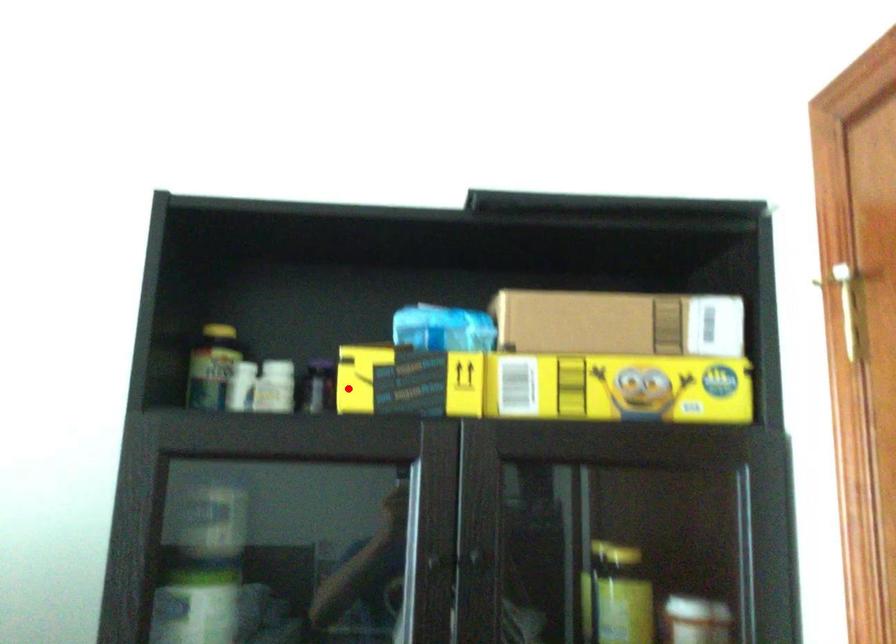
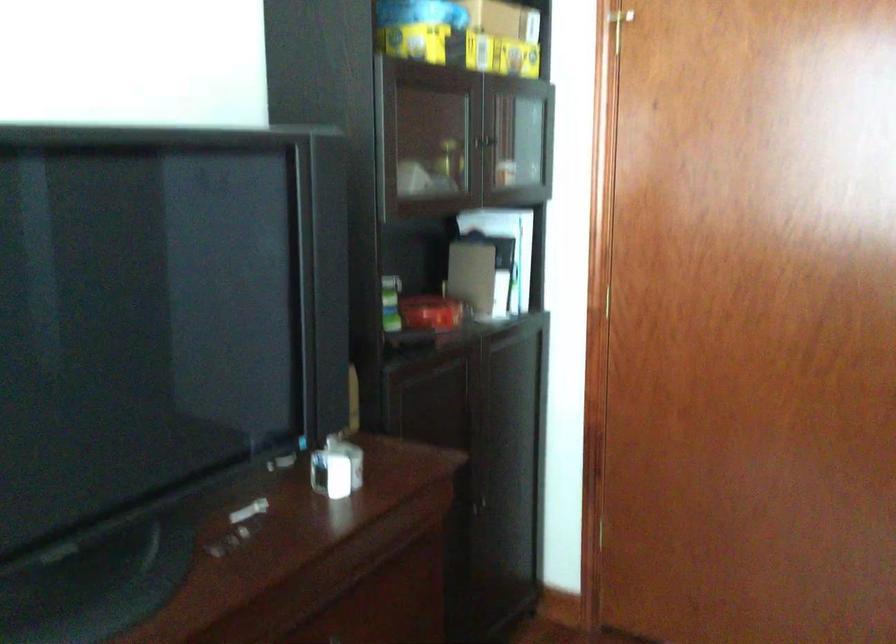
Where in the second image is the point corresponding to the highlighted location from the first image?

(415, 41)